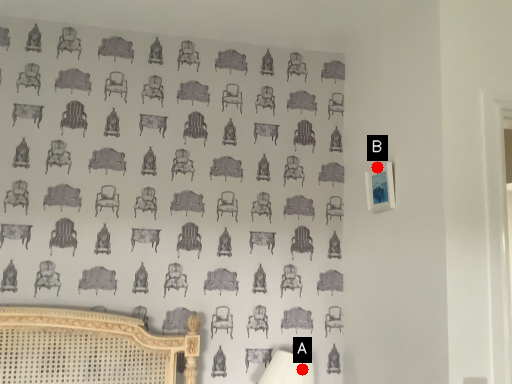
Question: Two points are circled on the image, labeled by A and B beside each circle. Which point appears farthest from the camera in this image?

Choices:
 (A) A is further
 (B) B is further

Answer: (B)